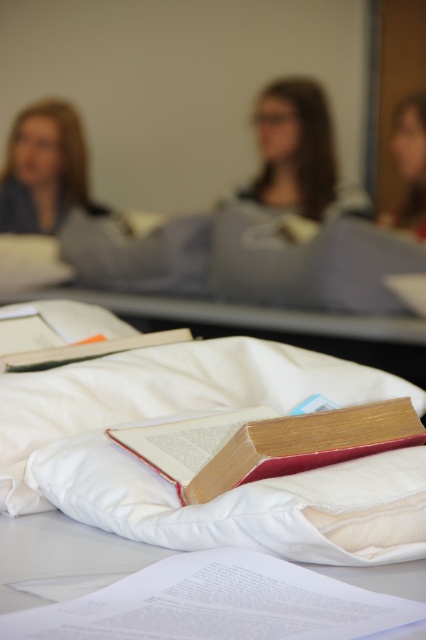
Question: Among these points, which one is farthest from the camera?

Choices:
 (A) (374, 448)
 (B) (261, 141)

Answer: (B)

Question: Is hardcover book at center to the right of matte gray sweater at center from the viewer's perspective?

Choices:
 (A) yes
 (B) no

Answer: (B)

Question: Which of the following is the closest to the observer?

Choices:
 (A) (39, 156)
 (B) (132, 342)

Answer: (B)

Question: In this image, where is white soft pillow at center located relative to matte gray sweater at center?

Choices:
 (A) above
 (B) below

Answer: (B)

Question: Which point is farther from the camera taking this photo?

Choices:
 (A) (77, 566)
 (B) (51, 113)

Answer: (B)

Question: Can you confirm if white soft pillow at center is positioned below white fabric at lower center?

Choices:
 (A) yes
 (B) no

Answer: (B)